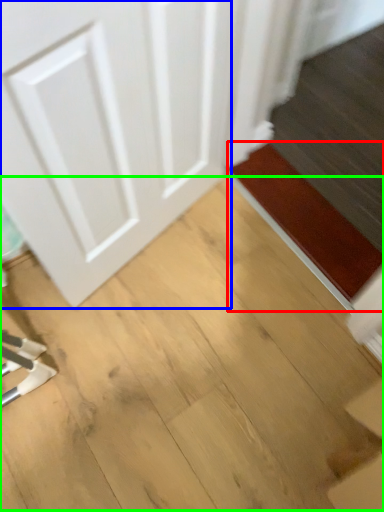
Question: Which object is positioned farthest from doormat (highlighted by a red box)? Select from door (highlighted by a blue box) and plywood (highlighted by a green box).

Choices:
 (A) door
 (B) plywood

Answer: (A)